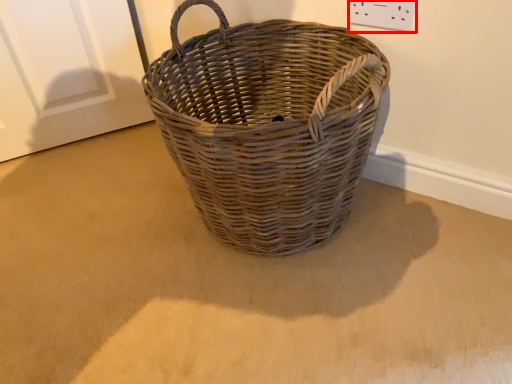
Question: From the image, what is the correct spatial relationship of electric outlet (annotated by the red box) in relation to picnic basket?

Choices:
 (A) left
 (B) right

Answer: (B)